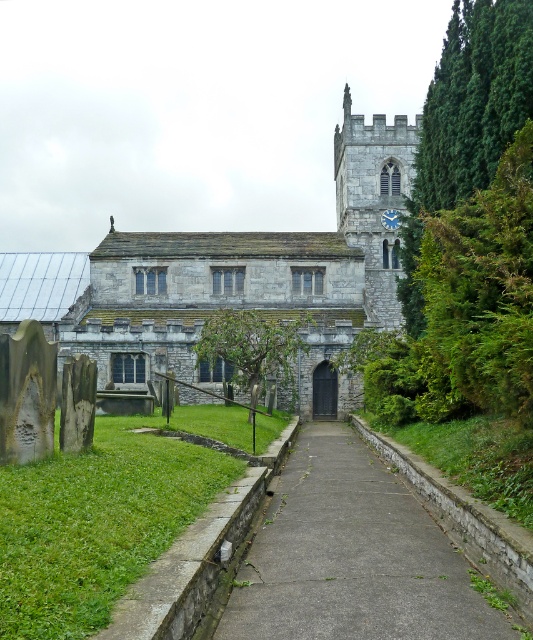
You are standing in front of the historic stone church and want to take a photo that includes both point (348, 259) and point (429, 532). Which point should you focus on first to ensure both are in focus?

You should focus on point (348, 259) first because it is closer to the camera than point (429, 532). This ensures that both points will be within the depth of field.

You are a visitor approaching the church and need to know if the gray stone church at center is wider than the concrete at center. Based on the scene, can you confirm this?

The gray stone church at center is wider than the concrete at center, so yes, the gray stone church at center is wider than the concrete at center.